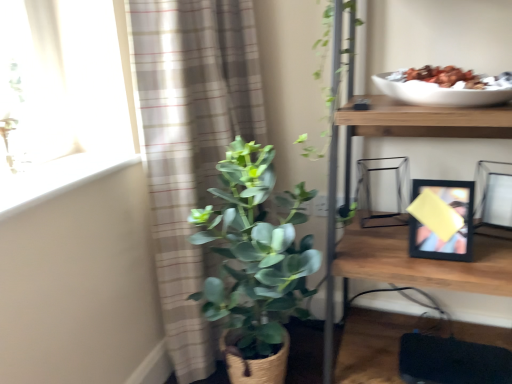
Question: From a real-world perspective, is white smooth window sill at upper left physically located above or below wooden shelf at upper right?

Choices:
 (A) above
 (B) below

Answer: (A)

Question: Is point 67,185 positioned closer to the camera than point 440,269?

Choices:
 (A) closer
 (B) farther

Answer: (A)

Question: Estimate the real-world distances between objects in this image. Which object is closer to the green matte plant at center?

Choices:
 (A) white smooth window sill at upper left
 (B) black matte picture frame at right, which is the 1th picture frame from left to right
 (C) matte black picture frame at right, marked as the 1th picture frame in a right-to-left arrangement
 (D) wooden shelf at upper right
 (E) plaid fabric curtain at left

Answer: (E)

Question: Considering the real-world distances, which object is closest to the wooden shelf at upper right?

Choices:
 (A) green matte plant at center
 (B) black matte picture frame at right, which is the 1th picture frame from left to right
 (C) matte black picture frame at right, marked as the 1th picture frame in a right-to-left arrangement
 (D) white smooth window sill at upper left
 (E) plaid fabric curtain at left

Answer: (B)